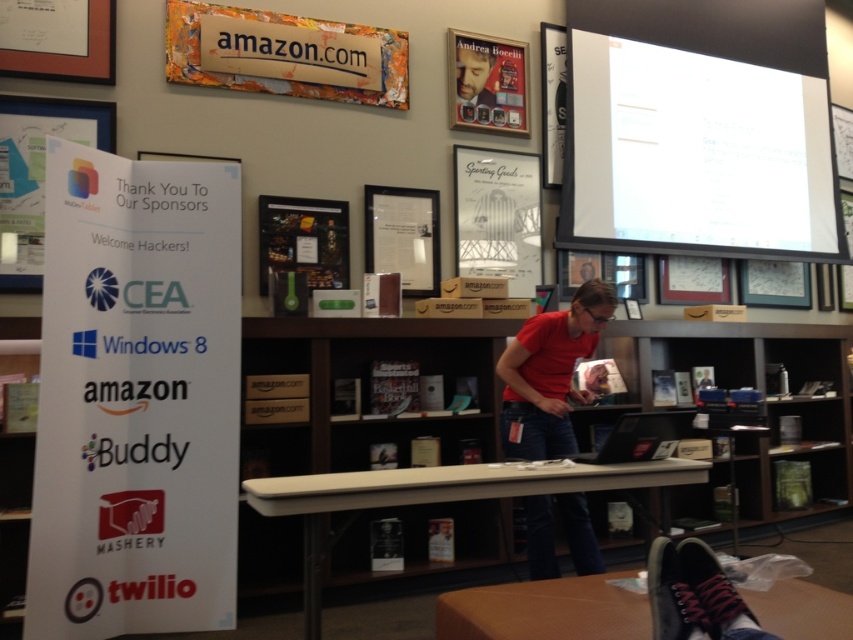
Which is more to the right, matte white poster at upper center or matte black laptop at center?

matte white poster at upper center is more to the right.

Is matte white poster at upper center below matte black laptop at center?

Indeed, matte white poster at upper center is positioned under matte black laptop at center.

Who is more forward, (498,244) or (476,104)?

Point (498,244)

At what (x,y) coordinates should I click in order to perform the action: click on matte white poster at upper center. Please return your answer as a coordinate pair (x, y). This screenshot has height=640, width=853. Looking at the image, I should click on (498, 216).

Does painted wood sign at upper center have a lesser width compared to red matte shirt at center?

In fact, painted wood sign at upper center might be wider than red matte shirt at center.

Can you confirm if painted wood sign at upper center is taller than red matte shirt at center?

No, painted wood sign at upper center is not taller than red matte shirt at center.

Is point (296, 96) positioned behind point (538, 566)?

Yes, it is behind point (538, 566).

You are a GUI agent. You are given a task and a screenshot of the screen. Output one action in this format:
    pyautogui.click(x=<x>, y=<y>)
    Task: Click on the painted wood sign at upper center
    This screenshot has width=853, height=640.
    Given the screenshot: What is the action you would take?
    pyautogui.click(x=285, y=54)

Can you confirm if white glossy projector screen at upper right is positioned to the right of brown wood table at lower center?

Correct, you'll find white glossy projector screen at upper right to the right of brown wood table at lower center.

Describe the element at coordinates (695, 154) in the screenshot. I see `white glossy projector screen at upper right` at that location.

Image resolution: width=853 pixels, height=640 pixels. I want to click on white glossy projector screen at upper right, so click(x=695, y=154).

At what (x,y) coordinates should I click in order to perform the action: click on white glossy projector screen at upper right. Please return your answer as a coordinate pair (x, y). This screenshot has width=853, height=640. Looking at the image, I should click on (695, 154).